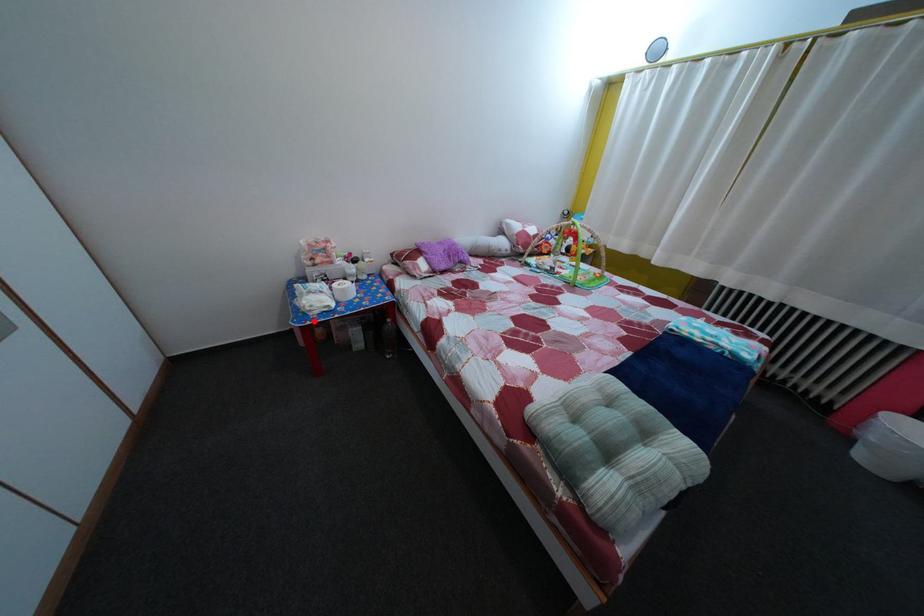
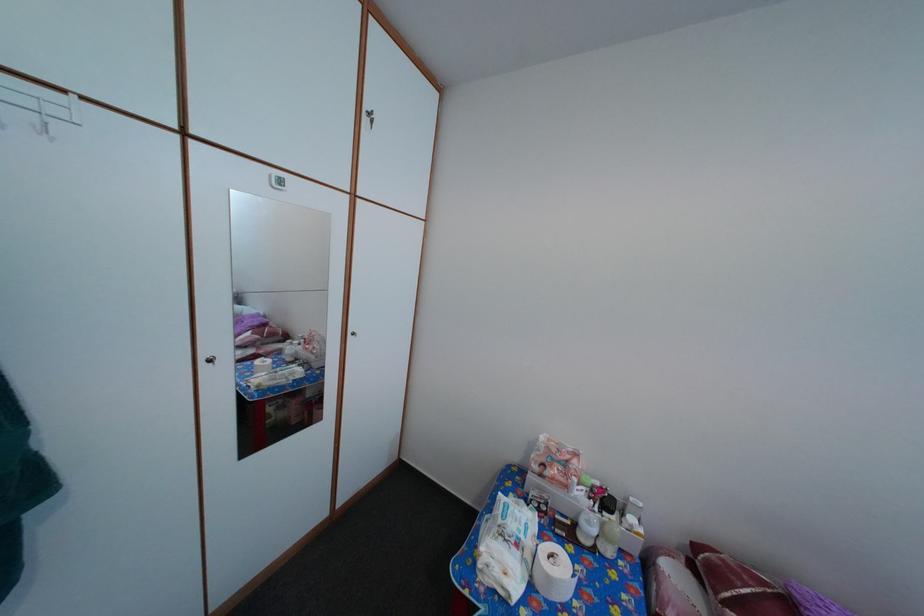
Find the pixel in the second image that matches the highlighted location in the first image.

(484, 572)